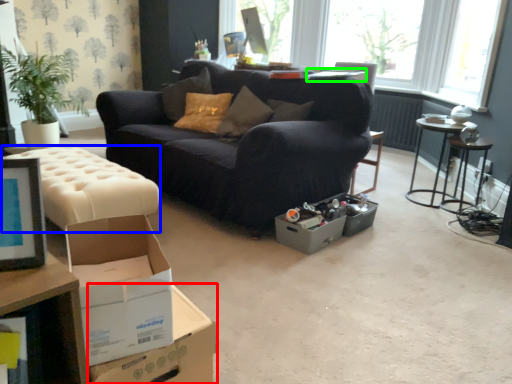
Question: Which object is the farthest from cardboard box (highlighted by a red box)? Choose among these: swivel chair (highlighted by a blue box) or table (highlighted by a green box).

Choices:
 (A) swivel chair
 (B) table

Answer: (B)